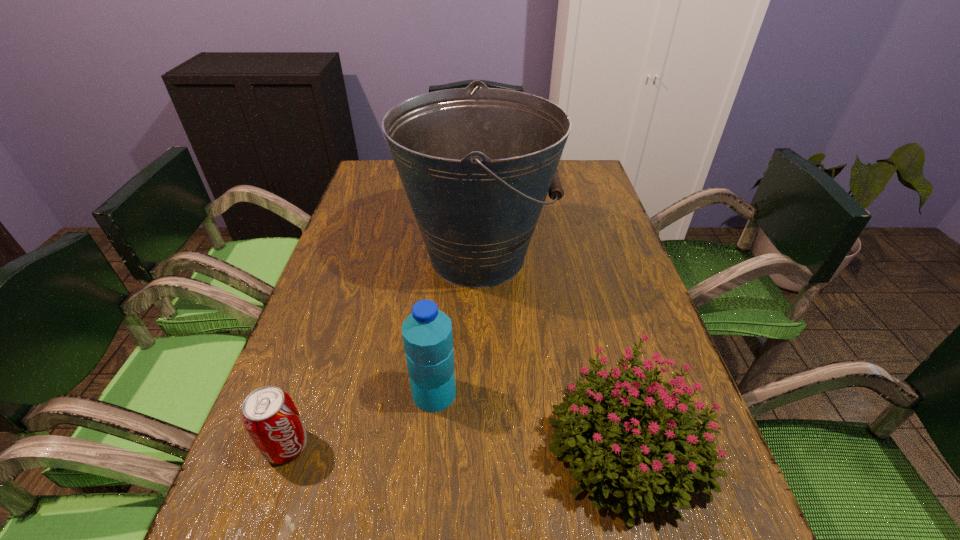
Identify the location of object present at the left edge. The height and width of the screenshot is (540, 960). (269, 415).

Locate an element on the screen. object at the right edge is located at coordinates coord(654,472).

In the image, there is a desktop. Where is `vacant space at the left edge`? The width and height of the screenshot is (960, 540). vacant space at the left edge is located at coordinates (320, 322).

Identify the location of vacant space at the right edge of the desktop. Image resolution: width=960 pixels, height=540 pixels. (576, 253).

You are a GUI agent. You are given a task and a screenshot of the screen. Output one action in this format:
    pyautogui.click(x=<x>, y=<y>)
    Task: Click on the vacant space at the far right corner of the desktop
    
    Given the screenshot: What is the action you would take?
    pyautogui.click(x=573, y=185)

At what (x,y) coordinates should I click in order to perform the action: click on free area in between the bucket and the water bottle. Please return your answer as a coordinate pair (x, y). The image size is (960, 540). Looking at the image, I should click on (456, 325).

I want to click on free space between the shortest object and the bucket, so click(382, 351).

Identify the location of free space between the bouquet and the farthest object. (552, 350).

You are a GUI agent. You are given a task and a screenshot of the screen. Output one action in this format:
    pyautogui.click(x=<x>, y=<y>)
    Task: Click on the empty space that is in between the tallest object and the water bottle
    Image resolution: width=960 pixels, height=540 pixels.
    Given the screenshot: What is the action you would take?
    pyautogui.click(x=456, y=325)

At what (x,y) coordinates should I click in order to perform the action: click on vacant space that's between the bouquet and the water bottle. Please return your answer as a coordinate pair (x, y). This screenshot has width=960, height=540. Looking at the image, I should click on (531, 418).